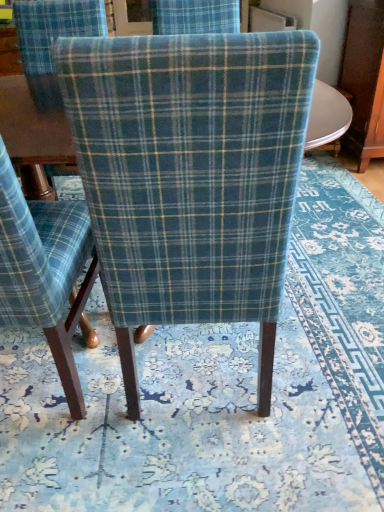
This screenshot has width=384, height=512. In order to click on plaid fabric chair at center, acting as the 2th chair starting from the left in this screenshot , I will do `click(190, 175)`.

Locate an element on the screen. blue plaid fabric chair at center, marked as the 1th chair in a left-to-right arrangement is located at coordinates (45, 272).

Is blue floral rug at center next to plaid fabric chair at center, acting as the 2th chair starting from the left?

blue floral rug at center and plaid fabric chair at center, acting as the 2th chair starting from the left, are clearly separated.

Can we say blue floral rug at center lies outside plaid fabric chair at center, acting as the 2th chair starting from the left?

Yes, blue floral rug at center is located beyond the bounds of plaid fabric chair at center, acting as the 2th chair starting from the left.

Is point (376, 405) positioned before point (276, 314)?

No.

From the image's perspective, between blue floral rug at center and plaid fabric chair at center, acting as the 2th chair starting from the left, who is located below?

plaid fabric chair at center, acting as the 2th chair starting from the left.

Can you tell me how much blue floral rug at center and blue plaid fabric chair at center, marked as the 1th chair in a left-to-right arrangement, differ in facing direction?

They differ by 177 degrees in their facing directions.

Who is taller, blue floral rug at center or blue plaid fabric chair at center, marked as the 1th chair in a left-to-right arrangement?

blue plaid fabric chair at center, marked as the 1th chair in a left-to-right arrangement, is taller.

Does blue floral rug at center contain blue plaid fabric chair at center, marked as the 1th chair in a left-to-right arrangement?

No, blue floral rug at center does not contain blue plaid fabric chair at center, marked as the 1th chair in a left-to-right arrangement.

Which of these two, blue floral rug at center or blue plaid fabric chair at center, the second chair when ordered from right to left, is bigger?

blue plaid fabric chair at center, the second chair when ordered from right to left.

How many degrees apart are the facing directions of blue plaid fabric chair at center, marked as the 1th chair in a left-to-right arrangement, and plaid fabric chair at center, the first chair from the right?

There is a 0.13-degree angle between the facing directions of blue plaid fabric chair at center, marked as the 1th chair in a left-to-right arrangement, and plaid fabric chair at center, the first chair from the right.

Is blue plaid fabric chair at center, marked as the 1th chair in a left-to-right arrangement, turned away from plaid fabric chair at center, the first chair from the right?

blue plaid fabric chair at center, marked as the 1th chair in a left-to-right arrangement, does not have its back to plaid fabric chair at center, the first chair from the right.

Are blue plaid fabric chair at center, the second chair when ordered from right to left, and plaid fabric chair at center, acting as the 2th chair starting from the left, making contact?

No, blue plaid fabric chair at center, the second chair when ordered from right to left, is not next to plaid fabric chair at center, acting as the 2th chair starting from the left.

At what (x,y) coordinates should I click in order to perform the action: click on the 1st chair to the left of the blue floral rug at center, counting from the anchor's position. Please return your answer as a coordinate pair (x, y). This screenshot has height=512, width=384. Looking at the image, I should click on (190, 175).

Which is farther from the camera, (164,274) or (272,431)?

The point (272,431) is farther from the camera.

Does plaid fabric chair at center, acting as the 2th chair starting from the left, have a lesser height compared to blue floral rug at center?

In fact, plaid fabric chair at center, acting as the 2th chair starting from the left, may be taller than blue floral rug at center.

In the scene shown: How much distance is there between blue plaid fabric chair at center, marked as the 1th chair in a left-to-right arrangement, and blue floral rug at center?

They are 47.30 centimeters apart.

Considering the sizes of objects blue plaid fabric chair at center, the second chair when ordered from right to left, and blue floral rug at center in the image provided, who is smaller, blue plaid fabric chair at center, the second chair when ordered from right to left, or blue floral rug at center?

blue floral rug at center is smaller.

Is blue plaid fabric chair at center, the second chair when ordered from right to left, located outside blue floral rug at center?

Absolutely, blue plaid fabric chair at center, the second chair when ordered from right to left, is external to blue floral rug at center.

From the image's perspective, which is below, plaid fabric chair at center, the first chair from the right, or blue plaid fabric chair at center, the second chair when ordered from right to left?

blue plaid fabric chair at center, the second chair when ordered from right to left, from the image's perspective.

Considering the sizes of objects plaid fabric chair at center, the first chair from the right, and blue plaid fabric chair at center, marked as the 1th chair in a left-to-right arrangement, in the image provided, who is bigger, plaid fabric chair at center, the first chair from the right, or blue plaid fabric chair at center, marked as the 1th chair in a left-to-right arrangement,?

plaid fabric chair at center, the first chair from the right, is bigger.

Does point (81, 173) come farther from viewer compared to point (87, 294)?

No, (81, 173) is closer to viewer.

Which is more to the right, plaid fabric chair at center, acting as the 2th chair starting from the left, or blue plaid fabric chair at center, the second chair when ordered from right to left?

From the viewer's perspective, plaid fabric chair at center, acting as the 2th chair starting from the left, appears more on the right side.

Where is `chair that is the 2nd object located in front of the blue floral rug at center`? chair that is the 2nd object located in front of the blue floral rug at center is located at coordinates pyautogui.click(x=190, y=175).

Where is `the 2nd chair below when counting from the blue floral rug at center (from the image's perspective)`? the 2nd chair below when counting from the blue floral rug at center (from the image's perspective) is located at coordinates (45, 272).

From the image, which object appears to be nearer to blue plaid fabric chair at center, the second chair when ordered from right to left, plaid fabric chair at center, acting as the 2th chair starting from the left, or blue floral rug at center?

Based on the image, plaid fabric chair at center, acting as the 2th chair starting from the left, appears to be nearer to blue plaid fabric chair at center, the second chair when ordered from right to left.

When comparing their distances from plaid fabric chair at center, acting as the 2th chair starting from the left, does blue floral rug at center or blue plaid fabric chair at center, marked as the 1th chair in a left-to-right arrangement, seem further?

blue floral rug at center is further to plaid fabric chair at center, acting as the 2th chair starting from the left.

When comparing their distances from blue floral rug at center, does plaid fabric chair at center, acting as the 2th chair starting from the left, or blue plaid fabric chair at center, marked as the 1th chair in a left-to-right arrangement, seem closer?

blue plaid fabric chair at center, marked as the 1th chair in a left-to-right arrangement, lies closer to blue floral rug at center than the other object.

From the image, which object appears to be farther from blue plaid fabric chair at center, marked as the 1th chair in a left-to-right arrangement, blue floral rug at center or plaid fabric chair at center, the first chair from the right?

blue floral rug at center is further to blue plaid fabric chair at center, marked as the 1th chair in a left-to-right arrangement.

Based on their spatial positions, is blue plaid fabric chair at center, the second chair when ordered from right to left, or plaid fabric chair at center, acting as the 2th chair starting from the left, closer to blue floral rug at center?

The object closer to blue floral rug at center is blue plaid fabric chair at center, the second chair when ordered from right to left.

Considering their positions, is blue plaid fabric chair at center, the second chair when ordered from right to left, positioned further to plaid fabric chair at center, the first chair from the right, than blue floral rug at center?

The object further to plaid fabric chair at center, the first chair from the right, is blue floral rug at center.

Image resolution: width=384 pixels, height=512 pixels. In order to click on chair between blue plaid fabric chair at center, the second chair when ordered from right to left, and blue floral rug at center in this screenshot , I will do `click(190, 175)`.